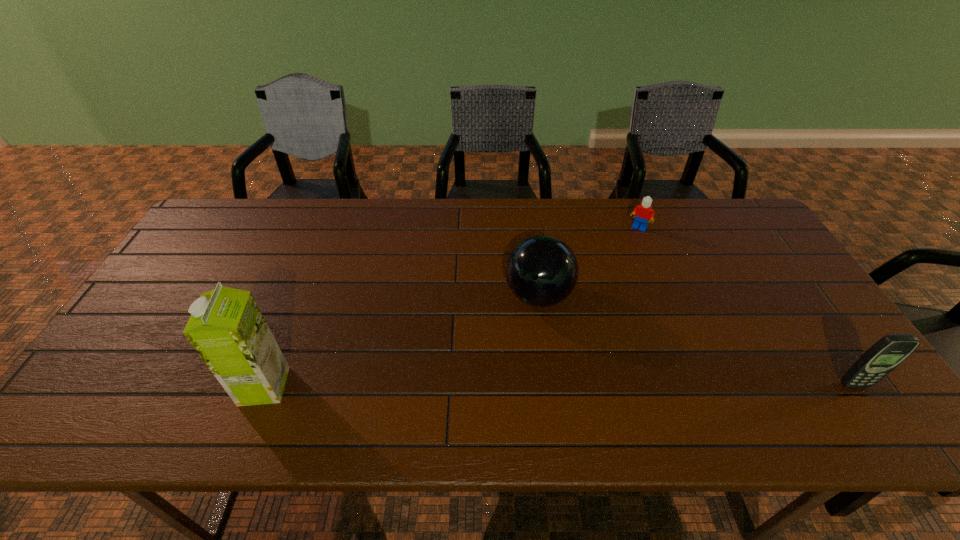
Identify the location of the leftmost object. (227, 329).

Where is `the tallest object`? the tallest object is located at coordinates (227, 329).

Where is `the rightmost object`? the rightmost object is located at coordinates (885, 355).

The height and width of the screenshot is (540, 960). I want to click on the shortest object, so click(x=642, y=213).

Find the location of a particular element. Lego is located at coordinates (642, 213).

Identify the location of the second farthest object. The height and width of the screenshot is (540, 960). (541, 271).

Where is `bowling ball`? bowling ball is located at coordinates (541, 271).

At what (x,y) coordinates should I click in order to perform the action: click on blank area located on the left of the soya milk. Please return your answer as a coordinate pair (x, y). Image resolution: width=960 pixels, height=540 pixels. Looking at the image, I should click on (113, 386).

You are a GUI agent. You are given a task and a screenshot of the screen. Output one action in this format:
    pyautogui.click(x=<x>, y=<y>)
    Task: Click on the vacant space situated on the face of the Lego
    The width and height of the screenshot is (960, 540).
    Given the screenshot: What is the action you would take?
    pyautogui.click(x=615, y=264)

This screenshot has width=960, height=540. What are the coordinates of `vacant space located on the face of the Lego` in the screenshot? It's located at (591, 301).